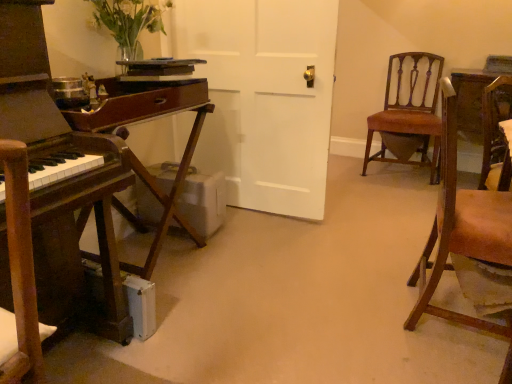
Question: Is brown leather chair at right, arranged as the second chair when viewed from the back, thinner than brown leather chair at right, acting as the first chair starting from the back?

Choices:
 (A) no
 (B) yes

Answer: (B)

Question: From a real-world perspective, does brown leather chair at right, positioned as the 1th chair in front-to-back order, sit lower than brown leather chair at right, acting as the first chair starting from the back?

Choices:
 (A) yes
 (B) no

Answer: (B)

Question: Is brown leather chair at right, positioned as the 1th chair in front-to-back order, completely or partially outside of brown leather chair at right, acting as the first chair starting from the back?

Choices:
 (A) no
 (B) yes

Answer: (B)

Question: Is brown leather chair at right, positioned as the 1th chair in front-to-back order, next to brown leather chair at right, acting as the first chair starting from the back, and touching it?

Choices:
 (A) yes
 (B) no

Answer: (B)

Question: Is brown leather chair at right, arranged as the second chair when viewed from the back, taller than brown leather chair at right, acting as the first chair starting from the back?

Choices:
 (A) yes
 (B) no

Answer: (A)

Question: Is brown wooden desk at left situated inside brown leather chair at right, the second chair from the front, or outside?

Choices:
 (A) outside
 (B) inside

Answer: (A)

Question: Is point (8, 291) closer or farther from the camera than point (397, 153)?

Choices:
 (A) closer
 (B) farther

Answer: (A)

Question: Considering the positions of brown wooden desk at left and brown leather chair at right, acting as the first chair starting from the back, in the image, is brown wooden desk at left taller or shorter than brown leather chair at right, acting as the first chair starting from the back,?

Choices:
 (A) short
 (B) tall

Answer: (B)

Question: From a real-world perspective, relative to brown leather chair at right, acting as the first chair starting from the back, is brown wooden desk at left vertically above or below?

Choices:
 (A) below
 (B) above

Answer: (B)

Question: Looking at the image, does brown wood table at left seem bigger or smaller compared to translucent glass vase at upper left?

Choices:
 (A) big
 (B) small

Answer: (A)

Question: Is brown wood table at left taller or shorter than translucent glass vase at upper left?

Choices:
 (A) tall
 (B) short

Answer: (A)

Question: Choose the correct answer: Is brown wood table at left inside translucent glass vase at upper left or outside it?

Choices:
 (A) inside
 (B) outside

Answer: (B)

Question: From a real-world perspective, is brown wood table at left positioned above or below translucent glass vase at upper left?

Choices:
 (A) above
 (B) below

Answer: (B)

Question: In the image, is brown wooden desk at left on the left side or the right side of translucent glass vase at upper left?

Choices:
 (A) right
 (B) left

Answer: (B)

Question: In terms of width, does brown wooden desk at left look wider or thinner when compared to translucent glass vase at upper left?

Choices:
 (A) thin
 (B) wide

Answer: (B)